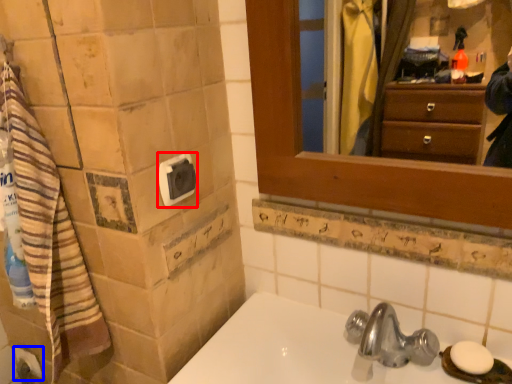
Question: Which object appears closest to the camera in this image, towel bar (highlighted by a red box) or toilet paper (highlighted by a blue box)?

Choices:
 (A) towel bar
 (B) toilet paper

Answer: (A)